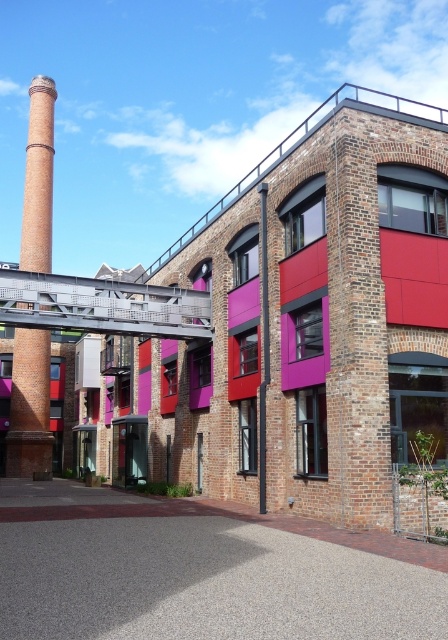
Question: Which of these objects is positioned closest to the brick at center?

Choices:
 (A) brick chimney at left
 (B) brick building at center

Answer: (B)

Question: Which point is farther to the camera?

Choices:
 (A) brick at center
 (B) brick chimney at left

Answer: (B)

Question: Which point is closer to the camera?

Choices:
 (A) click(232, 285)
 (B) click(12, 404)
 (C) click(367, 397)

Answer: (C)

Question: Is brick building at center below brick chimney at left?

Choices:
 (A) yes
 (B) no

Answer: (B)

Question: Is brick building at center wider than brick chimney at left?

Choices:
 (A) yes
 (B) no

Answer: (A)

Question: Can you confirm if brick at center is positioned above brick chimney at left?

Choices:
 (A) no
 (B) yes

Answer: (A)